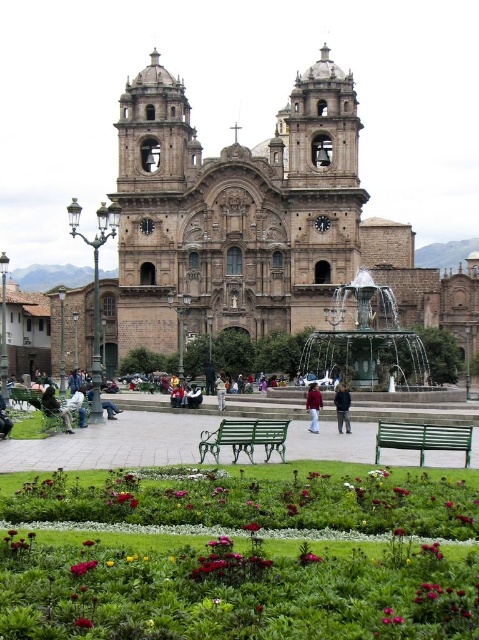
Does dark blue jacket at center appear over smooth pink rose at lower center?

Correct, dark blue jacket at center is located above smooth pink rose at lower center.

Does point (343, 400) come in front of point (90, 570)?

That is False.

Does point (340, 420) come in front of point (80, 561)?

No, (340, 420) is behind (80, 561).

The image size is (479, 640). Identify the location of dark blue jacket at center. (342, 406).

Which of these two, green patinated metal fountain at center or smooth red flower at center, stands shorter?

Standing shorter between the two is smooth red flower at center.

Does green patinated metal fountain at center appear under smooth red flower at center?

No.

What do you see at coordinates (366, 340) in the screenshot? Image resolution: width=479 pixels, height=640 pixels. I see `green patinated metal fountain at center` at bounding box center [366, 340].

The image size is (479, 640). I want to click on green patinated metal fountain at center, so click(366, 340).

Does dark gray fabric jacket at lower left have a greater height compared to light blue denim jacket at lower left?

Yes, dark gray fabric jacket at lower left is taller than light blue denim jacket at lower left.

Locate an element on the screen. The image size is (479, 640). dark gray fabric jacket at lower left is located at coordinates (55, 406).